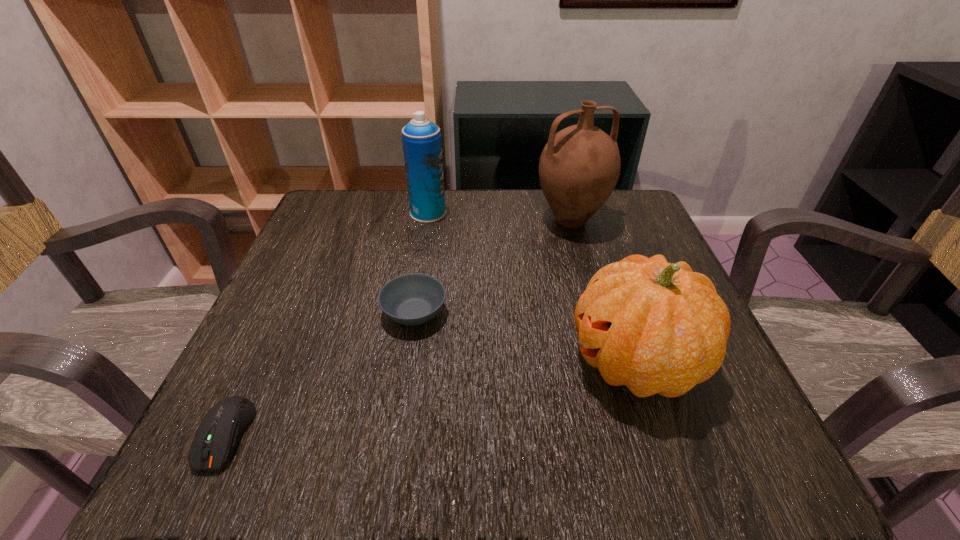
I want to click on blank space that satisfies the following two spatial constraints: 1. on the back side of the pitcher; 2. on the left side of the soup bowl, so click(x=429, y=220).